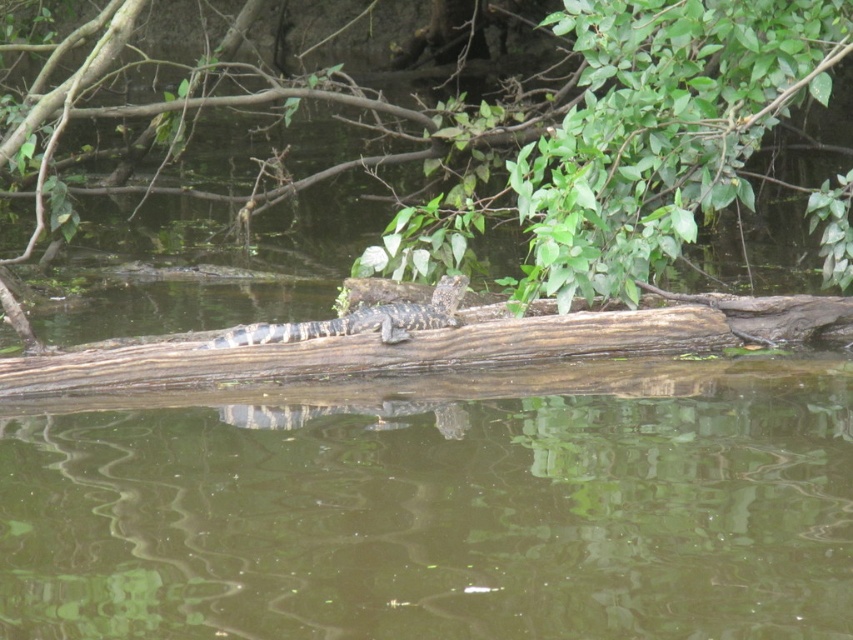
Between point (329, 579) and point (418, 118), which one is positioned in front?

Positioned in front is point (329, 579).

Who is more distant from viewer, (592, 518) or (515, 280)?

The point (515, 280) is more distant.

I want to click on brown wood log at center, so click(440, 508).

Between point (402, 163) and point (683, 317), which one is positioned in front?

Point (683, 317) is more forward.

This screenshot has width=853, height=640. In order to click on green leafy tree at upper center in this screenshot , I will do `click(520, 136)`.

Does brown wood log at center appear under brown textured log at center?

Indeed, brown wood log at center is positioned under brown textured log at center.

Which is more to the right, brown wood log at center or brown textured log at center?

brown wood log at center

Between point (718, 627) and point (694, 307), which one is positioned in front?

Point (718, 627) is in front.

Image resolution: width=853 pixels, height=640 pixels. In order to click on brown wood log at center in this screenshot , I will do `click(440, 508)`.